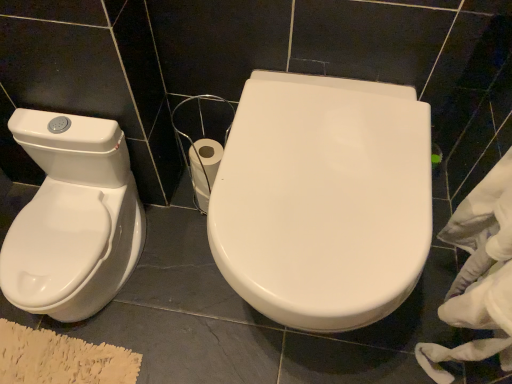
The image size is (512, 384). Find the location of `free space in front of white glossy bidet at left`. free space in front of white glossy bidet at left is located at coordinates (82, 352).